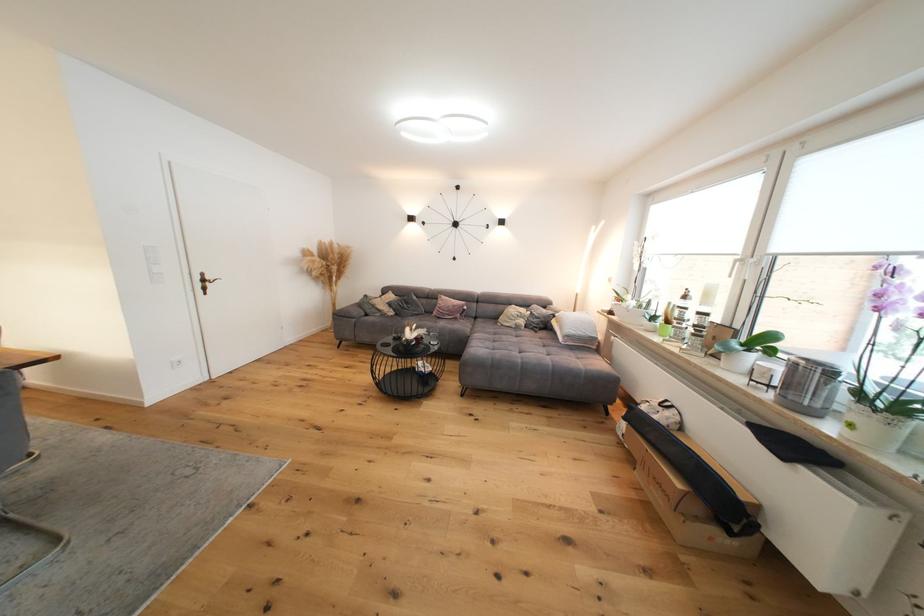
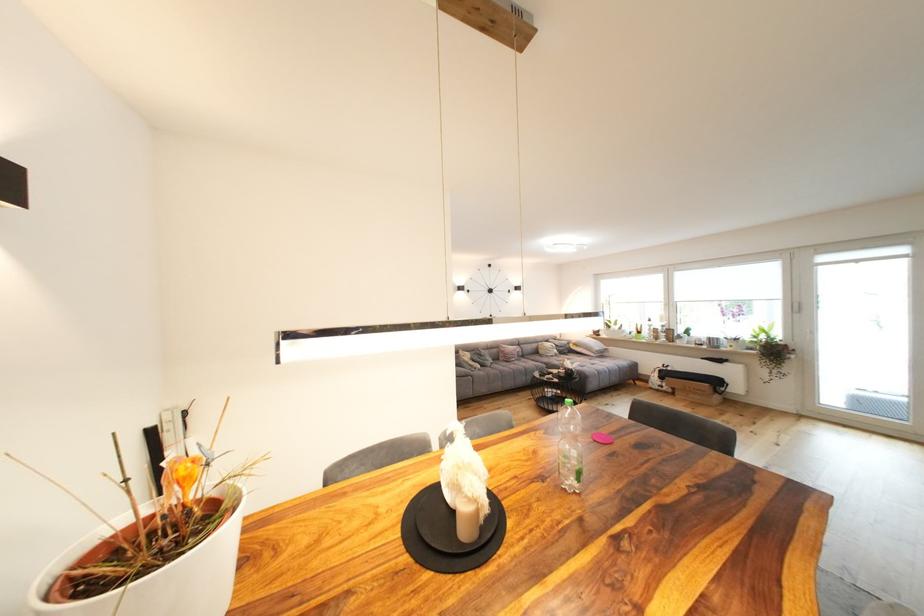
Where in the second image is the point corresponding to point (578, 333) from the first image?

(603, 350)